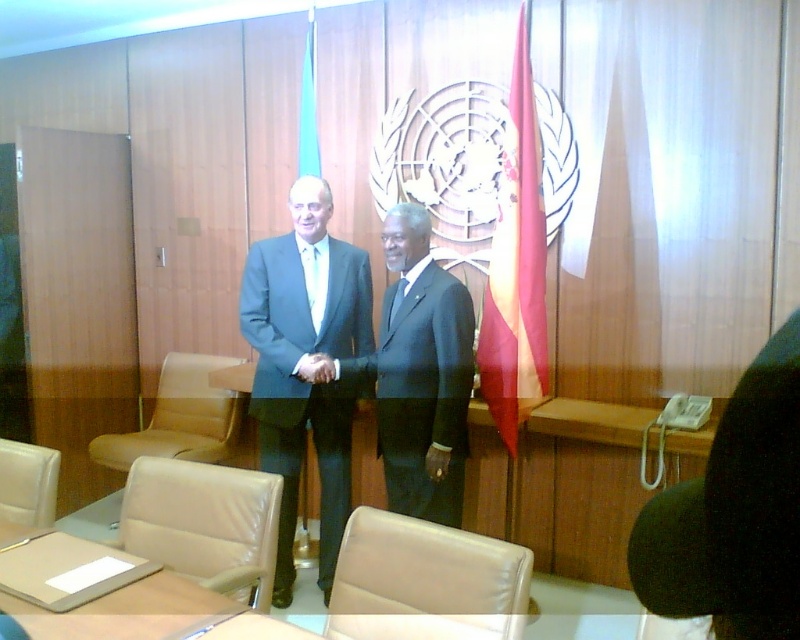
You are an event planner setting up a UN meeting. You need to place a decorative item at point (516, 266). Which object from the scene will this point be on?

The point (516, 266) is on the red fabric flag at right.

You are an event planner arranging a meeting in this room. You need to move the leather chair at lower left so that it is behind the smooth skin hand at center. Is this possible based on the current arrangement?

The leather chair at lower left is currently in front of the smooth skin hand at center. To move it behind, you would need to position it further away from the hand, which is possible as long as there is enough space in the room.

You are standing at the entrance of the room and want to approach the matte black suit at center. Which direction should you move to reach it?

Since the matte black suit at center is located at point (x=422, y=376), you should move towards the center of the room to reach it.